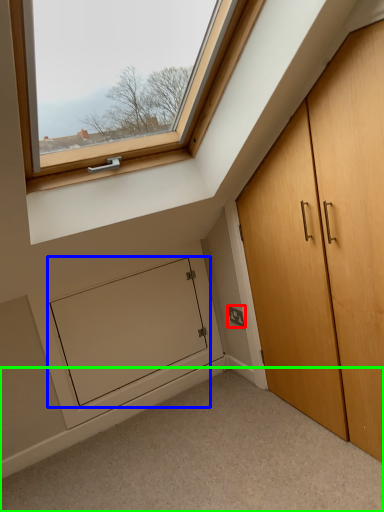
Question: Which object is positioned closest to electric outlet (highlighted by a red box)? Select from screen door (highlighted by a blue box) and corridor (highlighted by a green box).

Choices:
 (A) screen door
 (B) corridor

Answer: (A)